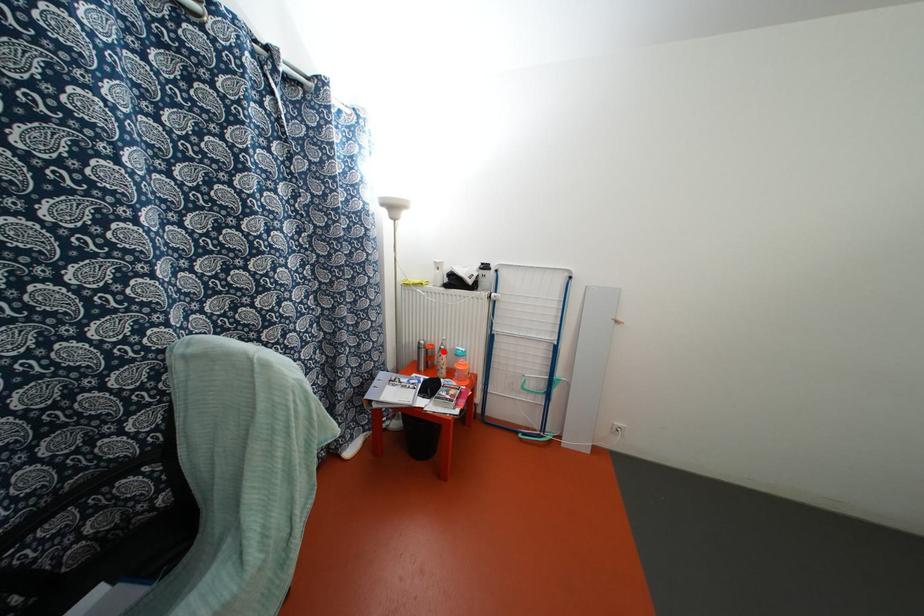
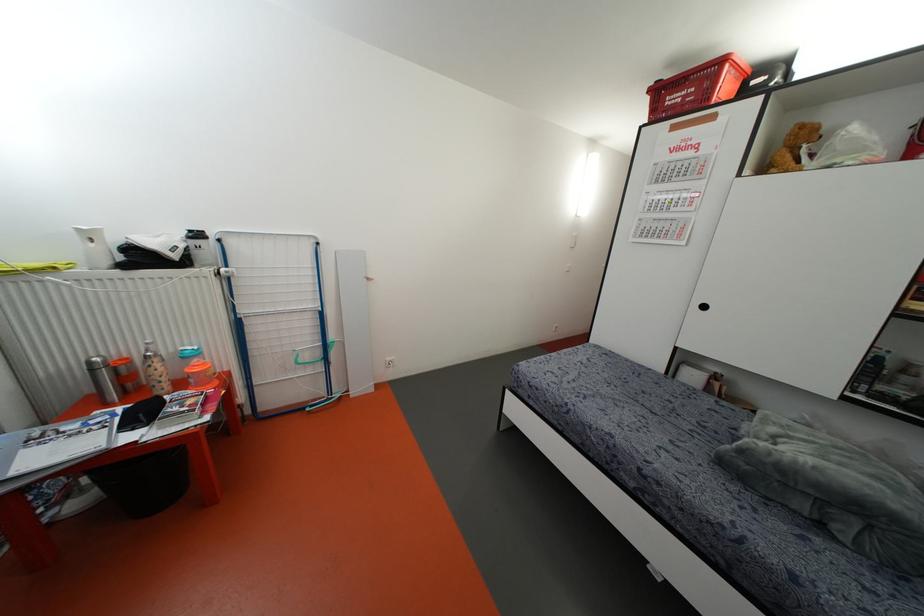
Question: I am providing you with two images of the same scene from different viewpoints. A red point is marked on the first image. At the location where the point appears in image 1, is it still visible in image 2?

Choices:
 (A) Yes
 (B) No

Answer: (A)